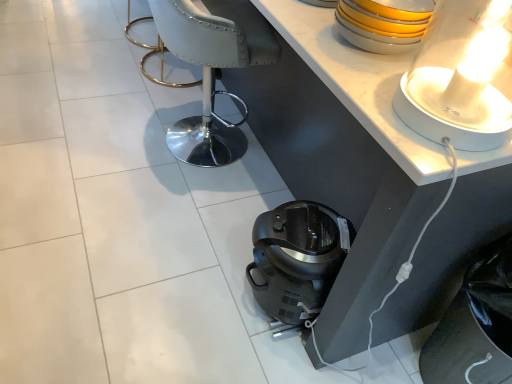
What are the coordinates of `vacant space in front of satin black coffee maker at lower center` in the screenshot? It's located at (271, 358).